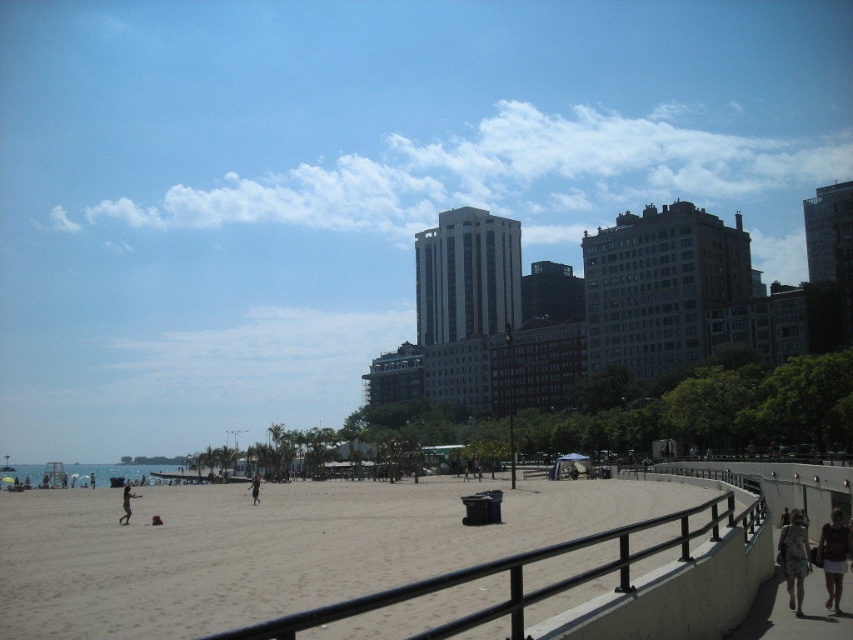
You are a drone operator trying to capture an aerial shot of the beach scene. The camera is currently positioned at point A, which is at coordinates 0.3, 0.4. You need to adjust the camera to focus on the transparent blue sky at upper center. Should you move the camera slightly to the left or right, and up or down to align with the sky?

The transparent blue sky at upper center is located at coordinates (351, 179). Since the camera is at (340, 192), you should move it slightly to the left and up to align with the sky.

You are standing at the center of the beach scene. You see a point marked at coordinates [793,557]. What object is located at that point?

The point at coordinates [793,557] corresponds to denim shorts at lower right.

What is located at the point with coordinates [351,179] in the beach scene?

The transparent blue sky at upper center is located at point [351,179].